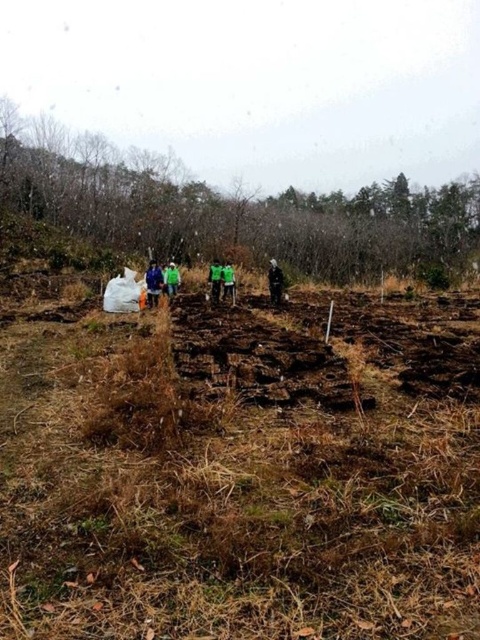
Which of these two, blue fabric jacket at center or black matte jacket at center, stands shorter?

Standing shorter between the two is blue fabric jacket at center.

Which is below, blue fabric jacket at center or black matte jacket at center?

blue fabric jacket at center is lower down.

What are the coordinates of `blue fabric jacket at center` in the screenshot? It's located at (153, 284).

Find the location of a particular element. Image resolution: width=480 pixels, height=640 pixels. blue fabric jacket at center is located at coordinates pos(153,284).

Between brown rough tree at upper center and green fabric person at center, which one appears on the right side from the viewer's perspective?

brown rough tree at upper center

Does point (52, 145) come behind point (231, 291)?

Yes, it is.

Locate an element on the screen. brown rough tree at upper center is located at coordinates (232, 209).

Does point (229, 284) come farther from viewer compared to point (169, 260)?

No, it is in front of (169, 260).

The image size is (480, 640). Describe the element at coordinates (228, 282) in the screenshot. I see `green fabric person at center` at that location.

Find the location of `green fabric person at center`. green fabric person at center is located at coordinates (228, 282).